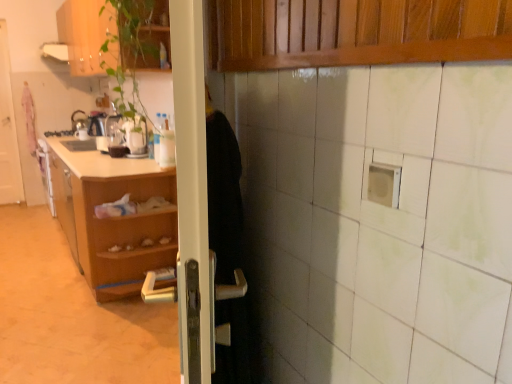
In order to face wooden at left, should I rotate leftwards or rightwards?

A 19.949 degree turn to the left will do.

Where is `white glossy door at left`? white glossy door at left is located at coordinates (8, 132).

The image size is (512, 384). I want to click on white glossy exhaust hood at upper left, so click(55, 51).

Is white glossy door at left facing towards wooden at left?

No.

Considering the relative sizes of white glossy door at left and wooden at left in the image provided, is white glossy door at left smaller than wooden at left?

Yes, white glossy door at left is smaller than wooden at left.

Does white glossy door at left appear on the left side of wooden at left?

Yes, white glossy door at left is to the left of wooden at left.

Would you say white glossy exhaust hood at upper left is to the left or to the right of wooden at left in the picture?

Clearly, white glossy exhaust hood at upper left is on the left of wooden at left in the image.

Is white glossy exhaust hood at upper left bigger than wooden at left?

Actually, white glossy exhaust hood at upper left might be smaller than wooden at left.

In order to click on shelf on the right of the white glossy exhaust hood at upper left in this screenshot , I will do `click(113, 218)`.

Can you confirm if white glossy exhaust hood at upper left is bigger than white glossy door at left?

Incorrect, white glossy exhaust hood at upper left is not larger than white glossy door at left.

Between point (63, 47) and point (13, 124), which one is positioned in front?

Positioned in front is point (63, 47).

Between white glossy exhaust hood at upper left and white glossy door at left, which one is positioned in front?

white glossy exhaust hood at upper left.

From the image's perspective, relative to white glossy door at left, is white glossy exhaust hood at upper left above or below?

white glossy exhaust hood at upper left is situated higher than white glossy door at left in the image.

Based on the photo, does white glossy door at left have a lesser width compared to white glossy exhaust hood at upper left?

Indeed, white glossy door at left has a lesser width compared to white glossy exhaust hood at upper left.

Is white glossy door at left not within white glossy exhaust hood at upper left?

Yes, white glossy door at left is located beyond the bounds of white glossy exhaust hood at upper left.

What's the angular difference between white glossy door at left and white glossy exhaust hood at upper left's facing directions?

white glossy door at left and white glossy exhaust hood at upper left are facing 90.6 degrees away from each other.

Does point (6, 126) come closer to viewer compared to point (41, 51)?

Yes, point (6, 126) is in front of point (41, 51).

Is wooden cabinet at upper left bigger than shiny metallic kettle at left?

Indeed, wooden cabinet at upper left has a larger size compared to shiny metallic kettle at left.

From a real-world perspective, which object rests below the other?

From a 3D spatial view, shiny metallic kettle at left is below.

Is point (57, 19) positioned in front of point (84, 119)?

That is False.

How many degrees apart are the facing directions of wooden cabinet at upper left and shiny metallic kettle at left?

0.258 degrees separate the facing orientations of wooden cabinet at upper left and shiny metallic kettle at left.

Does wooden at left have a greater width compared to white glossy door at left?

Indeed, wooden at left has a greater width compared to white glossy door at left.

Is wooden at left spatially inside white glossy door at left, or outside of it?

wooden at left is not inside white glossy door at left, it's outside.

The height and width of the screenshot is (384, 512). Find the location of `door to the left of wooden at left`. door to the left of wooden at left is located at coordinates (8, 132).

Does point (159, 177) come closer to viewer compared to point (8, 182)?

Yes.

In terms of height, does wooden at left look taller or shorter compared to shiny metallic kettle at left?

In the image, wooden at left appears to be taller than shiny metallic kettle at left.

Does wooden at left have a larger size compared to shiny metallic kettle at left?

Yes.

Consider the image. Is the position of wooden at left less distant than that of shiny metallic kettle at left?

Yes, the depth of wooden at left is less than that of shiny metallic kettle at left.

Would you say wooden at left is a long distance from shiny metallic kettle at left?

Yes, wooden at left and shiny metallic kettle at left are located far from each other.

This screenshot has width=512, height=384. I want to click on door above the wooden at left (from the image's perspective), so click(8, 132).

This screenshot has height=384, width=512. In order to click on exhaust hood above the wooden at left (from a real-world perspective) in this screenshot , I will do `click(55, 51)`.

Estimate the real-world distances between objects in this image. Which object is further from white glossy door at left, wooden at left or white glossy exhaust hood at upper left?

Among the two, wooden at left is located further to white glossy door at left.

Considering their positions, is shiny metallic kettle at left positioned further to wooden at left than wooden cabinet at upper left?

Among the two, shiny metallic kettle at left is located further to wooden at left.

Based on their spatial positions, is white glossy exhaust hood at upper left or wooden at left closer to shiny metallic kettle at left?

white glossy exhaust hood at upper left is positioned closer to the anchor shiny metallic kettle at left.

Which object lies further to the anchor point white glossy exhaust hood at upper left, white glossy door at left or wooden cabinet at upper left?

wooden cabinet at upper left lies further to white glossy exhaust hood at upper left than the other object.

Estimate the real-world distances between objects in this image. Which object is closer to white glossy door at left, white glossy exhaust hood at upper left or wooden at left?

The object closer to white glossy door at left is white glossy exhaust hood at upper left.

Estimate the real-world distances between objects in this image. Which object is further from wooden cabinet at upper left, wooden at left or white glossy door at left?

Among the two, white glossy door at left is located further to wooden cabinet at upper left.

Which object lies nearer to the anchor point shiny metallic kettle at left, white glossy exhaust hood at upper left or wooden cabinet at upper left?

Based on the image, wooden cabinet at upper left appears to be nearer to shiny metallic kettle at left.

When comparing their distances from shiny metallic kettle at left, does white glossy door at left or wooden at left seem further?

wooden at left is positioned further to the anchor shiny metallic kettle at left.

Identify the location of door located between wooden cabinet at upper left and shiny metallic kettle at left in the depth direction. (8, 132).

Find the location of a particular element. This screenshot has width=512, height=384. exhaust hood between wooden cabinet at upper left and white glossy door at left in the front-back direction is located at coordinates (55, 51).

This screenshot has height=384, width=512. Find the location of `exhaust hood between wooden at left and shiny metallic kettle at left from front to back`. exhaust hood between wooden at left and shiny metallic kettle at left from front to back is located at coordinates (55, 51).

Locate an element on the screen. This screenshot has width=512, height=384. exhaust hood between wooden at left and white glossy door at left from front to back is located at coordinates (x=55, y=51).